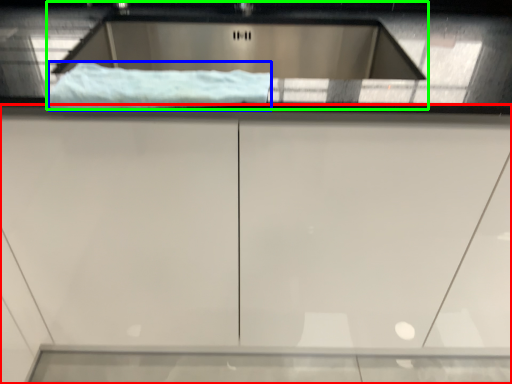
Question: Which object is the farthest from cabinetry (highlighted by a red box)? Choose among these: material (highlighted by a blue box) or sink (highlighted by a green box).

Choices:
 (A) material
 (B) sink

Answer: (B)